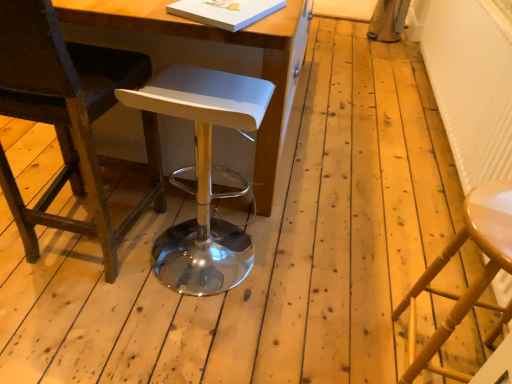
I want to click on free space that is in between dark brown leather chair at left and wooden chair at right, positioned as the second stool in left-to-right order, so (261, 313).